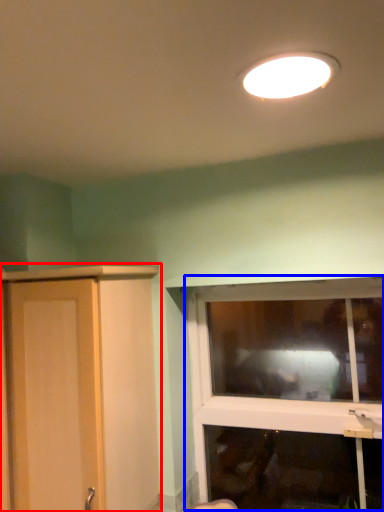
Question: Which object appears farthest to the camera in this image, cupboard (highlighted by a red box) or window (highlighted by a blue box)?

Choices:
 (A) cupboard
 (B) window

Answer: (B)